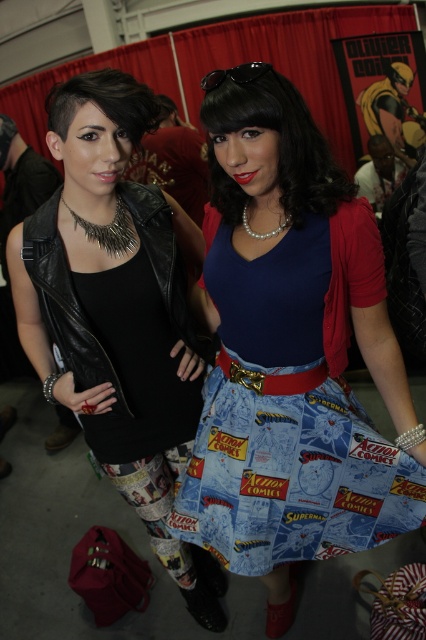
Question: Which point is farther from the camera taking this photo?

Choices:
 (A) (265, 548)
 (B) (69, 330)

Answer: (A)

Question: Which object is positioned closest to the comic book fabric skirt at center?

Choices:
 (A) black leather jacket at left
 (B) matte black vest at left

Answer: (A)

Question: Which of the following is the farthest from the observer?

Choices:
 (A) (158, 218)
 (B) (271, 440)

Answer: (A)

Question: Is matte black vest at left further to the viewer compared to comic book fabric skirt at center?

Choices:
 (A) yes
 (B) no

Answer: (A)

Question: Does matte black vest at left appear under comic book fabric skirt at center?

Choices:
 (A) yes
 (B) no

Answer: (A)

Question: Does comic book fabric skirt at center have a smaller size compared to black leather jacket at left?

Choices:
 (A) no
 (B) yes

Answer: (A)